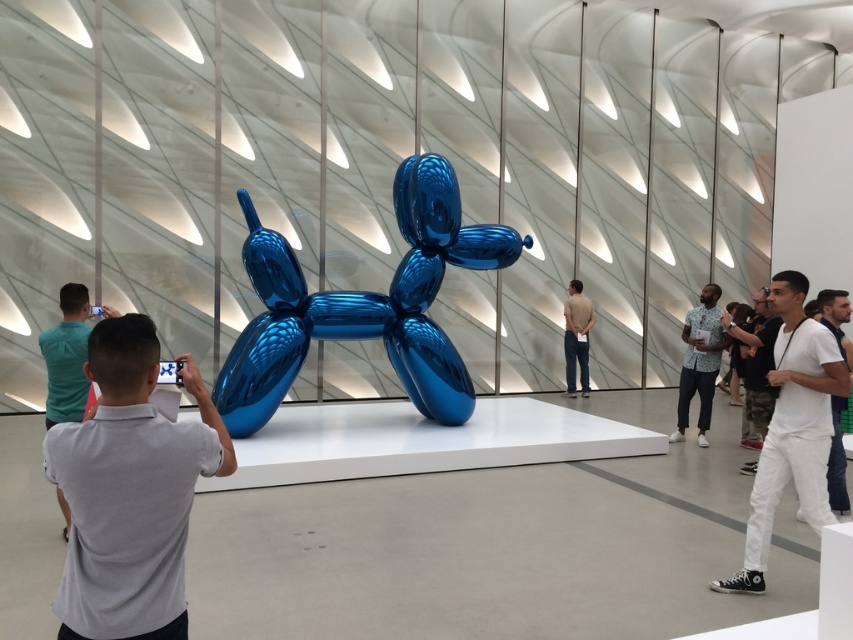
You are standing in the art gallery and want to take a photo of the shiny blue balloon dog at center without the light gray shirt at left appearing in the frame. Is this possible based on their positions?

The shiny blue balloon dog at center is further to the viewer than the light gray shirt at left. Therefore, it is possible to take a photo of the shiny blue balloon dog at center without the light gray shirt at left appearing in the frame by positioning yourself so the shirt is out of the shot.

You are a photographer standing in the art gallery. You want to take a photo of the shiny blue balloon dog at center while also including the light gray shirt at left in the frame. Based on their positions, which object should you position closer to the left side of your camera viewfinder?

The light gray shirt at left should be positioned closer to the left side of your camera viewfinder since it is already to the left of the shiny blue balloon dog at center.

In the scene shown: You are a photographer in the gallery and want to capture both the floral shirt at right and the white matte shirt at right in the same frame. Which shirt should you adjust your camera angle to include first if you need to focus on the wider one?

You should focus on the white matte shirt at right first because it is wider than the floral shirt at right.